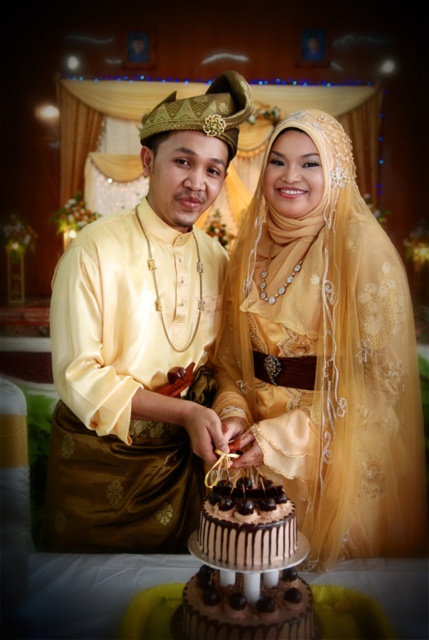
Does matte gold dress at center have a larger size compared to chocolate frosted cake at center?

Yes.

Where is `matte gold dress at center`? This screenshot has height=640, width=429. matte gold dress at center is located at coordinates (323, 352).

You are a GUI agent. You are given a task and a screenshot of the screen. Output one action in this format:
    pyautogui.click(x=<x>, y=<y>)
    Task: Click on the matte gold dress at center
    This screenshot has width=429, height=640.
    Given the screenshot: What is the action you would take?
    point(323,352)

Between satin yellow shirt at center and chocolatesmoothcake at center, which one has less height?

With less height is chocolatesmoothcake at center.

I want to click on satin yellow shirt at center, so click(141, 340).

How much distance is there between chocolatesmoothcake at center and chocolate frosted cake at center?

chocolatesmoothcake at center is 4.68 inches away from chocolate frosted cake at center.

Can you confirm if chocolatesmoothcake at center is positioned to the left of chocolate frosted cake at center?

No, chocolatesmoothcake at center is not to the left of chocolate frosted cake at center.

The width and height of the screenshot is (429, 640). Describe the element at coordinates (247, 609) in the screenshot. I see `chocolatesmoothcake at center` at that location.

Where is `chocolatesmoothcake at center`? chocolatesmoothcake at center is located at coordinates (247, 609).